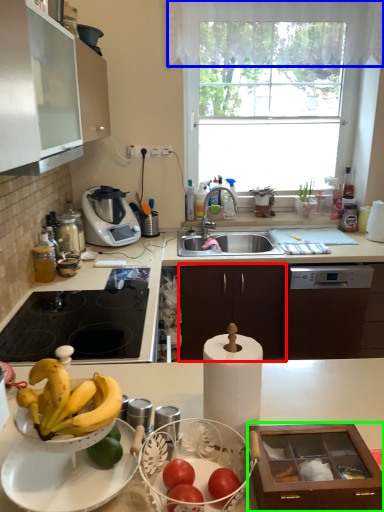
Question: Which object is the closest to the cabinetry (highlighted by a red box)? Choose among these: curtain (highlighted by a blue box) or cabinetry (highlighted by a green box).

Choices:
 (A) curtain
 (B) cabinetry

Answer: (A)